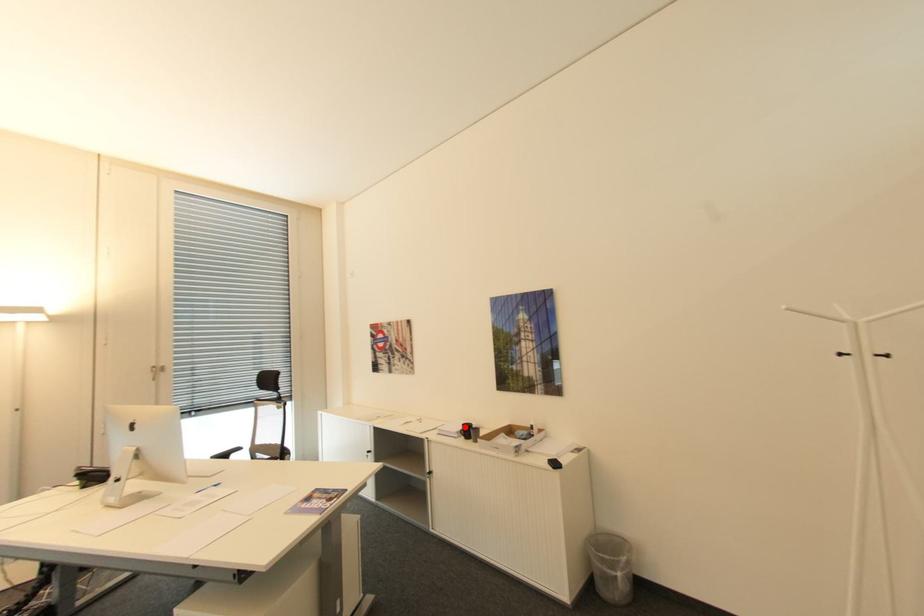
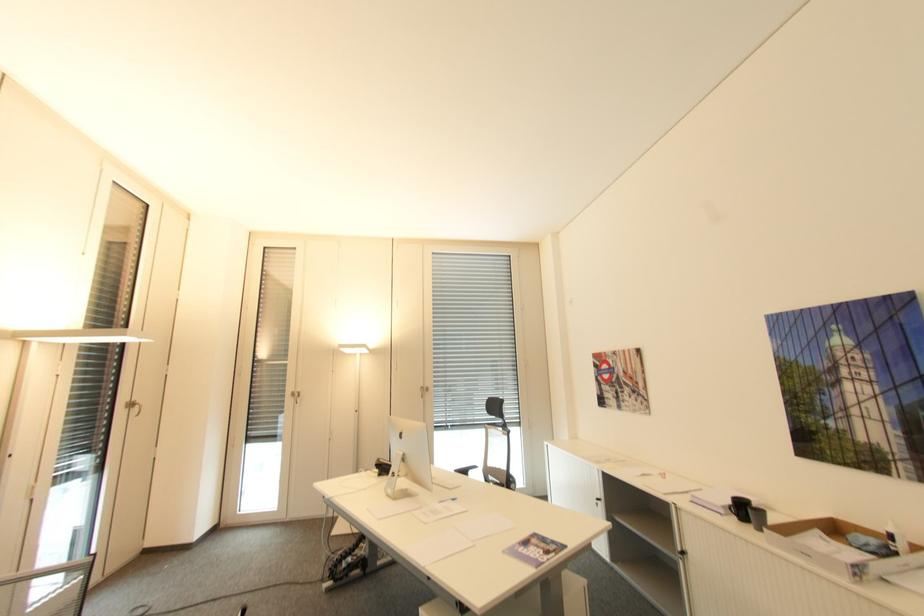
Where in the second image is the point corresponding to the highlighted location from the first image?

(734, 501)